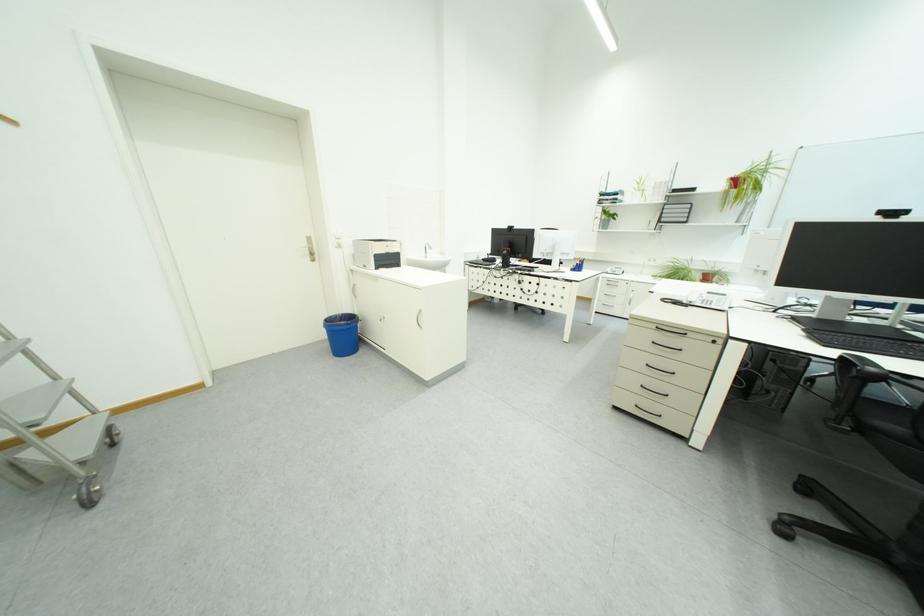
What do you see at coordinates (310, 248) in the screenshot?
I see `the silver door handle` at bounding box center [310, 248].